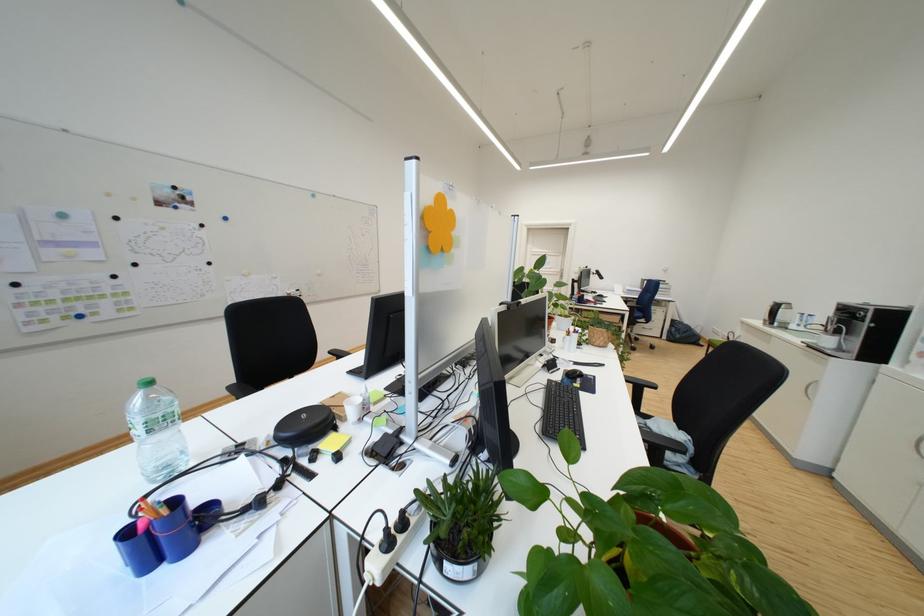
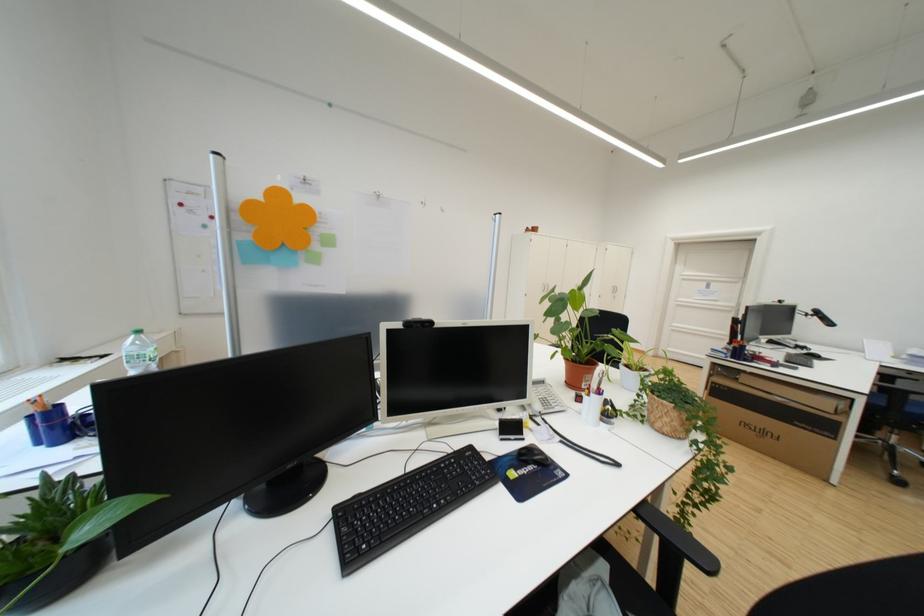
Where in the second image is the point corresponding to point (659, 392) from the first image?

(700, 567)